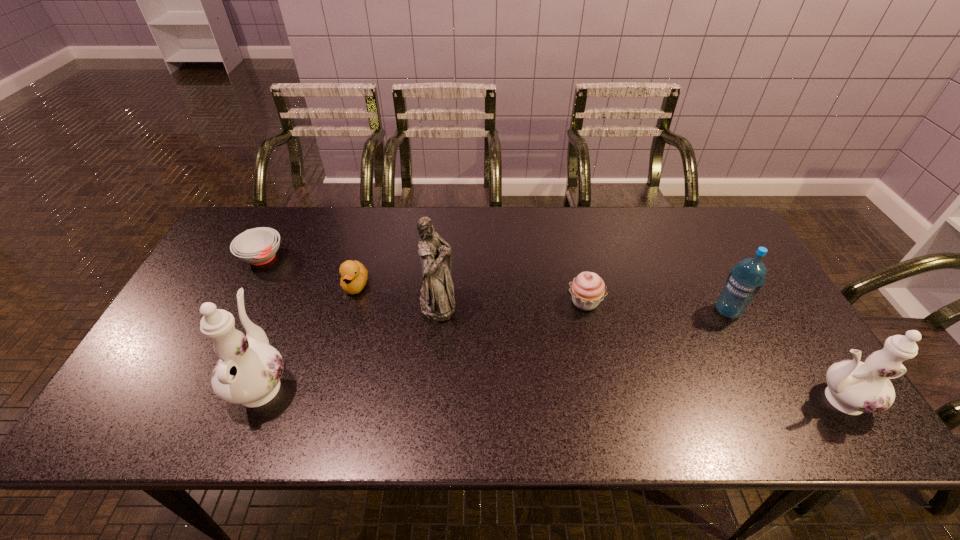
If the aim is uniform spacing by inserting an additional chinaware among them, please point to a vacant space for this new chinaware. Please provide its 2D coordinates. Your answer should be formatted as a tuple, i.e. [(x, y)], where the tuple contains the x and y coordinates of a point satisfying the conditions above.

[(545, 391)]